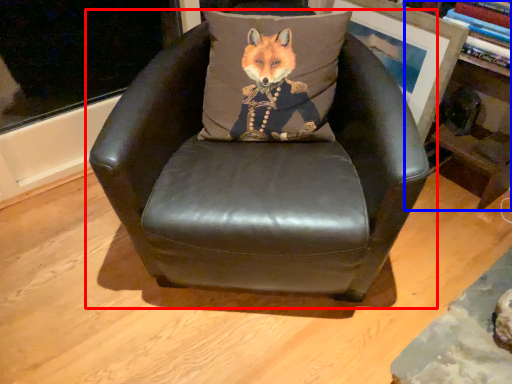
Question: Which object is closer to the camera taking this photo, chair (highlighted by a red box) or bookshelf (highlighted by a blue box)?

Choices:
 (A) chair
 (B) bookshelf

Answer: (A)